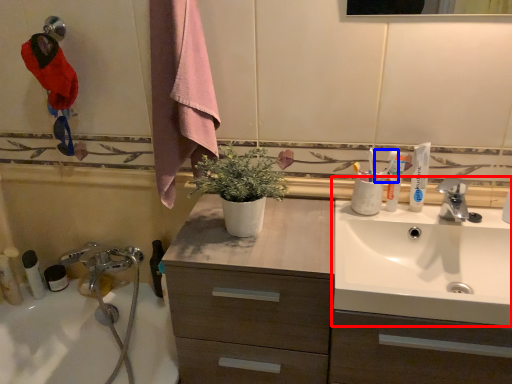
Question: Which object appears farthest to the camera in this image, sink (highlighted by a red box) or toothpaste (highlighted by a blue box)?

Choices:
 (A) sink
 (B) toothpaste

Answer: (B)